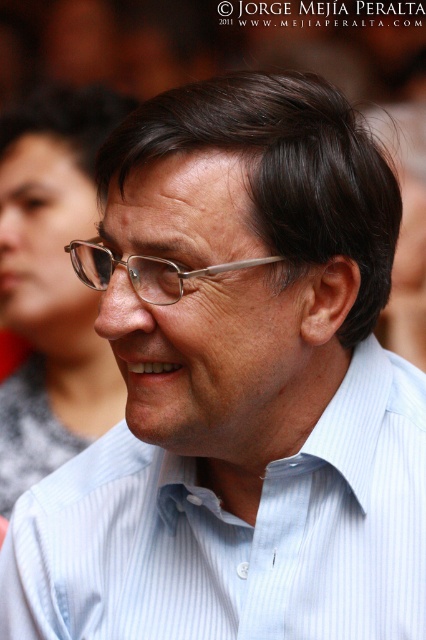
Who is more forward, (13, 584) or (149, 276)?

Point (149, 276) is more forward.

Can you confirm if light blue striped dress shirt at center is thinner than metallic silver glasses at center?

Incorrect, light blue striped dress shirt at center's width is not less than metallic silver glasses at center's.

Does point (201, 595) come closer to viewer compared to point (224, 266)?

No, it is behind (224, 266).

Locate an element on the screen. The image size is (426, 640). light blue striped dress shirt at center is located at coordinates (235, 532).